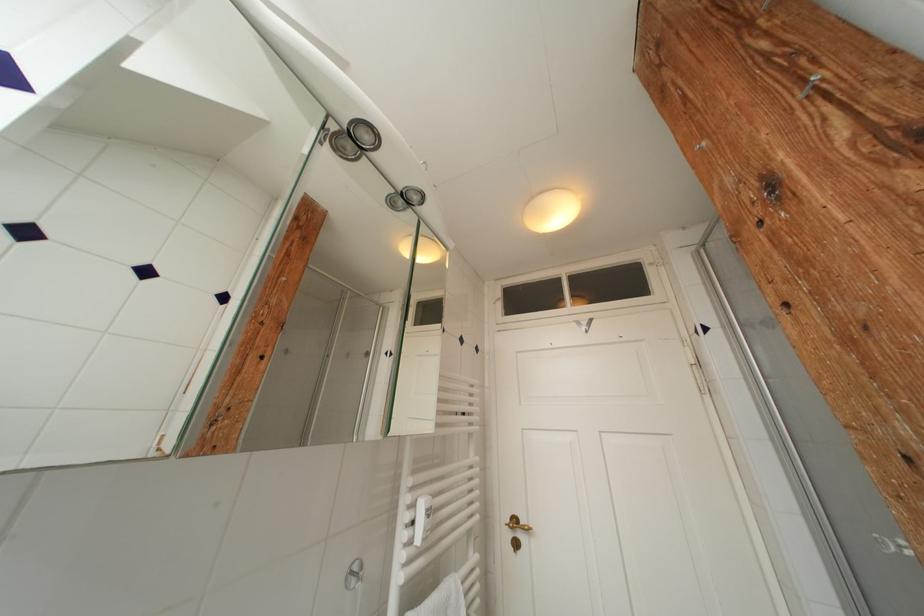
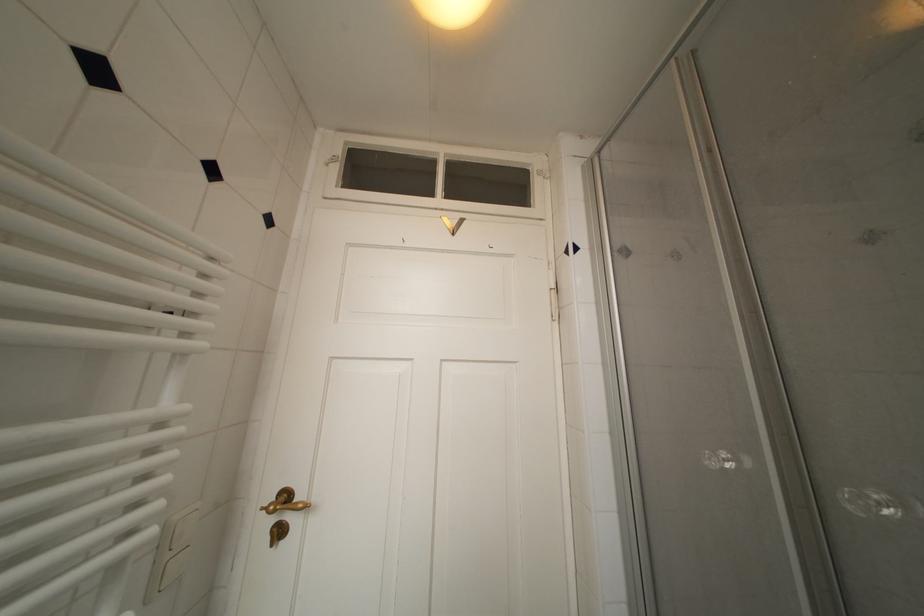
Find the pixel in the second image that matches (x=521, y=525) in the first image.

(293, 500)